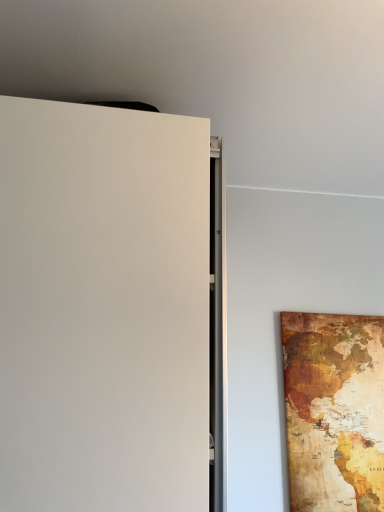
Measure the distance between wooden map at right and camera.

wooden map at right is 4.27 feet away from camera.

Identify the location of wooden map at right. (334, 410).

The width and height of the screenshot is (384, 512). Describe the element at coordinates (334, 410) in the screenshot. I see `wooden map at right` at that location.

I want to click on wooden map at right, so click(x=334, y=410).